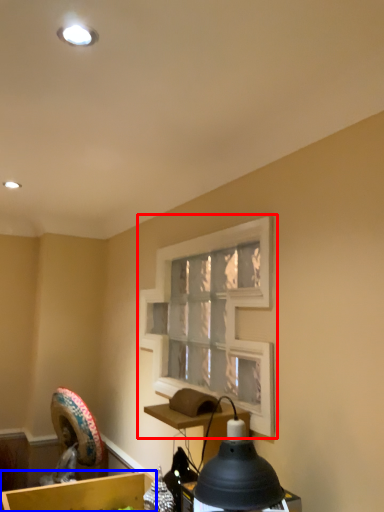
Question: Which object appears farthest to the camera in this image, window frame (highlighted by a red box) or cardboard box (highlighted by a blue box)?

Choices:
 (A) window frame
 (B) cardboard box

Answer: (B)